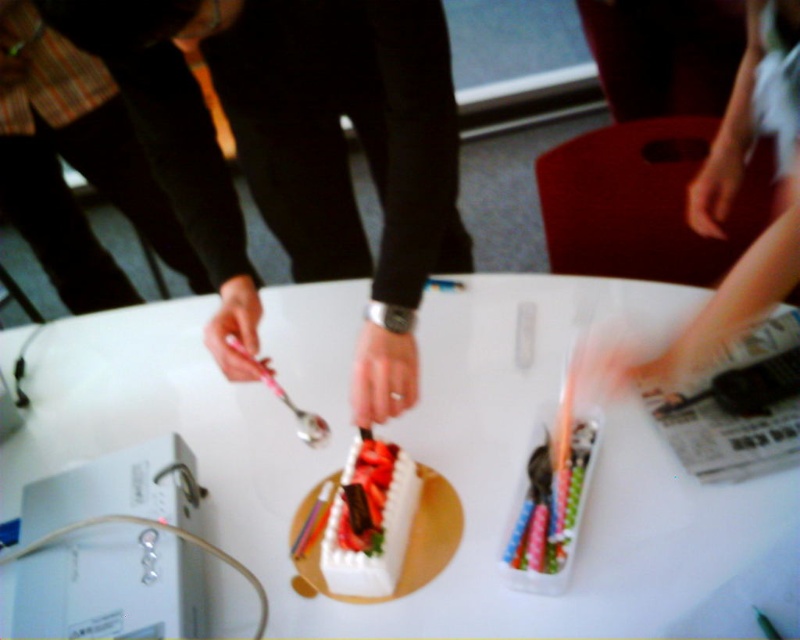
Question: Estimate the real-world distances between objects in this image. Which object is closer to the matte silver spoon at center?

Choices:
 (A) smooth silver watch at center
 (B) pink plastic pen at center
 (C) smooth skin hand at upper right
 (D) white frosted cake at center

Answer: (B)

Question: Considering the relative positions of white plastic table at center and matte silver spoon at center in the image provided, where is white plastic table at center located with respect to matte silver spoon at center?

Choices:
 (A) right
 (B) left

Answer: (B)

Question: Which object is positioned farthest from the smooth skin hand at upper right?

Choices:
 (A) smooth silver watch at center
 (B) pink plastic pen at center
 (C) smooth white arm at upper right
 (D) white frosted cake at center

Answer: (B)

Question: Is white frosted cake at center thinner than pink plastic pen at center?

Choices:
 (A) no
 (B) yes

Answer: (B)

Question: Is white plastic table at center to the right of matte silver spoon at center from the viewer's perspective?

Choices:
 (A) yes
 (B) no

Answer: (B)

Question: Which point appears farthest from the camera in this image?

Choices:
 (A) (772, 80)
 (B) (324, 200)
 (C) (236, 337)
 (D) (698, 224)

Answer: (B)